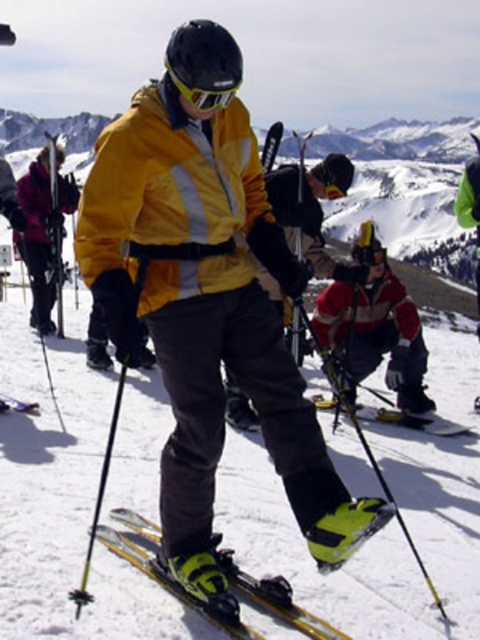
You are standing at point (x=7, y=406) and want to move to point (x=73, y=198). Based on the scene, will you have to go forward or backward?

Since point (x=73, y=198) is behind point (x=7, y=406), you would need to move backward to reach it.

You are a skier who just arrived at the slope and need to locate your matte black ski pole at left. According to the scene description, where exactly is it located in the image?

The matte black ski pole at left is located at point (41, 234) in the image.